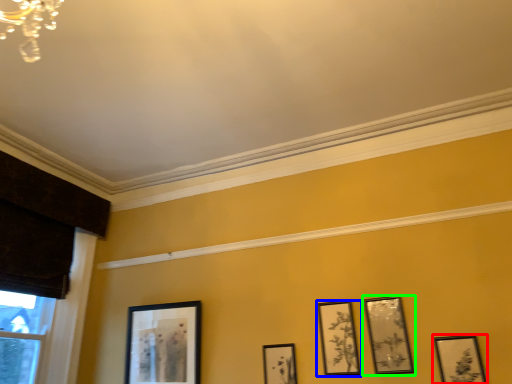
Question: Which is farther away from picture frame (highlighted by a red box)? picture frame (highlighted by a blue box) or picture frame (highlighted by a green box)?

Choices:
 (A) picture frame
 (B) picture frame

Answer: (A)